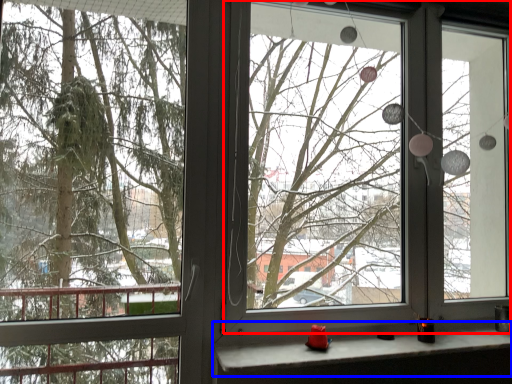
Question: Which object is further to the camera taking this photo, window screen (highlighted by a red box) or window sill (highlighted by a blue box)?

Choices:
 (A) window screen
 (B) window sill

Answer: (A)